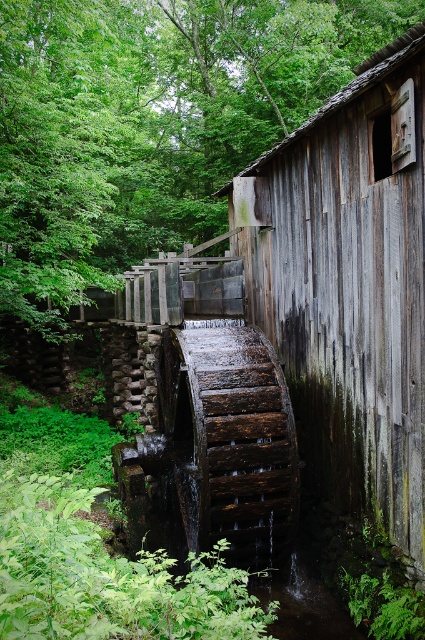
Who is positioned more to the left, green leafy forest at upper left or weathered wood hut at center?

green leafy forest at upper left is more to the left.

Is point (59, 230) farther from viewer compared to point (360, 84)?

That is True.

I want to click on green leafy forest at upper left, so click(x=150, y=122).

Locate an element on the screen. The height and width of the screenshot is (640, 425). green leafy forest at upper left is located at coordinates (150, 122).